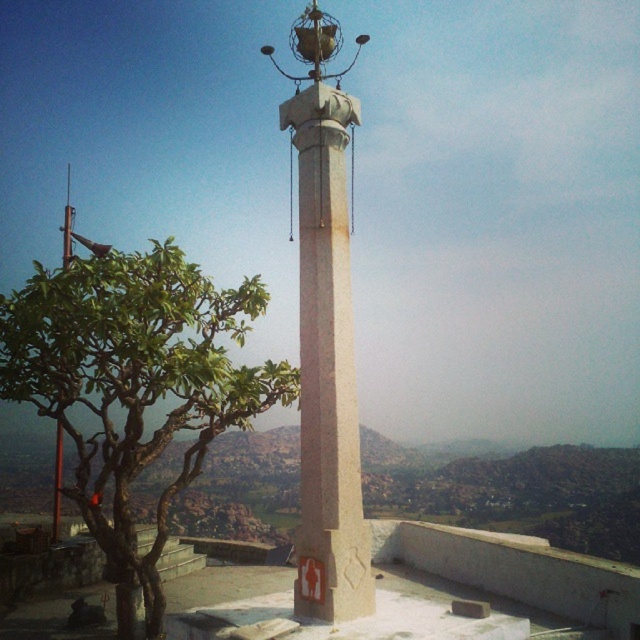
Question: Which point appears closest to the camera in this image?

Choices:
 (A) (339, 616)
 (B) (150, 556)

Answer: (A)

Question: Among these objects, which one is nearest to the camera?

Choices:
 (A) white stone column at center
 (B) green leafy tree at left

Answer: (A)

Question: Can you confirm if green leafy tree at left is positioned to the right of white stone column at center?

Choices:
 (A) no
 (B) yes

Answer: (A)

Question: Can you confirm if green leafy tree at left is positioned to the right of white stone column at center?

Choices:
 (A) yes
 (B) no

Answer: (B)

Question: Is green leafy tree at left to the left of white stone column at center from the viewer's perspective?

Choices:
 (A) no
 (B) yes

Answer: (B)